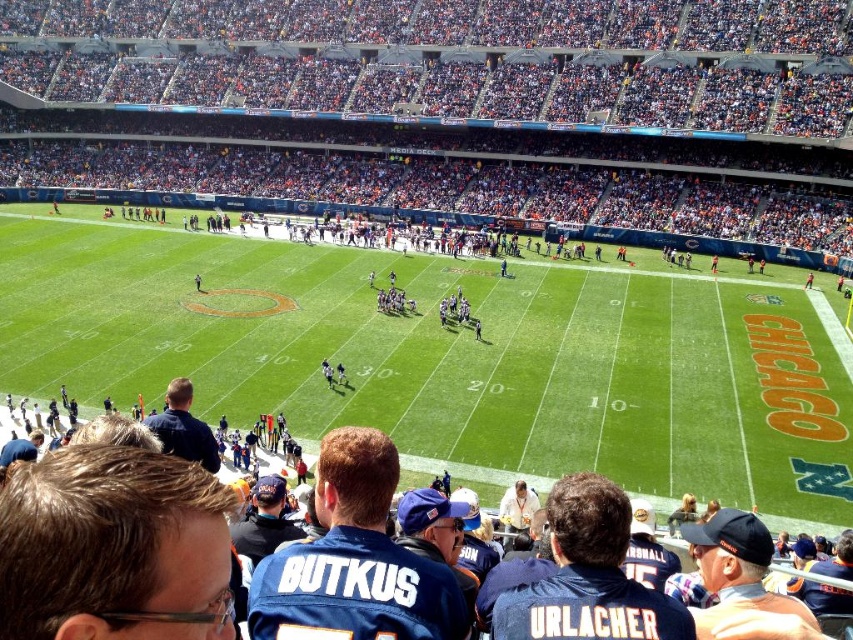
You are designing a stadium layout and need to place a new concession stand. The stand must be placed either on the green grass football field at center or near the blue jersey at center. Considering their sizes, which location would allow for a larger concession stand?

The green grass football field at center has a larger size compared to the blue jersey at center, so placing the concession stand on the green grass football field at center would allow for a larger structure.

You are a photographer standing at the edge of the field. You want to take a photo that includes both the green grass football field at center and the blue jersey at center. Which object will appear larger in the photo?

The green grass football field at center will appear larger in the photo because it has a greater height compared to the blue jersey at center.